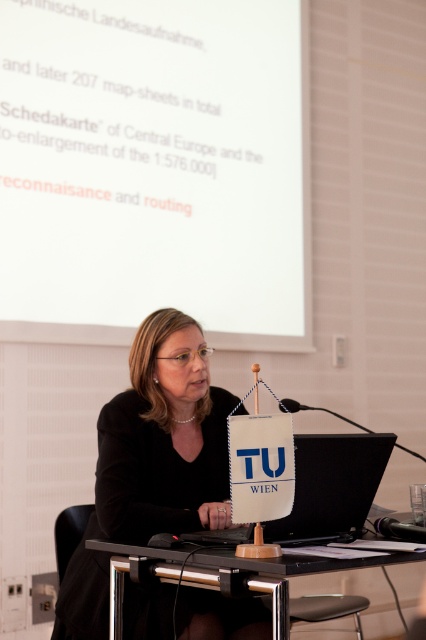
Question: Observing the image, what is the correct spatial positioning of white matte projection screen at upper center in reference to black matte jacket at center?

Choices:
 (A) right
 (B) left

Answer: (A)

Question: Which point is closer to the camera taking this photo?

Choices:
 (A) (258, 582)
 (B) (293, 435)
 (C) (143, 230)

Answer: (A)

Question: Which point is farther to the camera?

Choices:
 (A) black matte jacket at center
 (B) white matte projection screen at upper center
 (C) black matte laptop at center
 (D) black glass table at center

Answer: (B)

Question: Is black matte jacket at center above black glass table at center?

Choices:
 (A) yes
 (B) no

Answer: (A)

Question: Which point is closer to the camera?

Choices:
 (A) (382, 557)
 (B) (198, 99)
 (C) (68, 596)
 (D) (218, 532)

Answer: (A)

Question: Can you confirm if white matte projection screen at upper center is wider than black matte jacket at center?

Choices:
 (A) no
 (B) yes

Answer: (B)